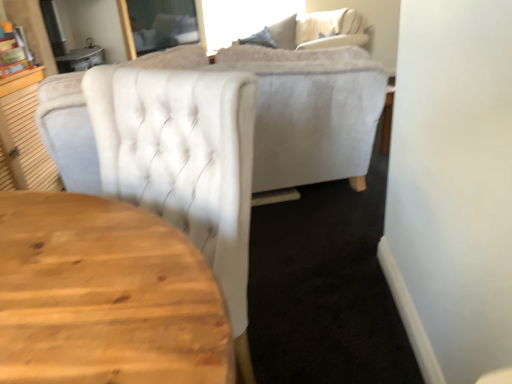
Question: From a real-world perspective, relative to velvet beige couch at upper center, is white tufted chair at upper center vertically above or below?

Choices:
 (A) above
 (B) below

Answer: (A)

Question: Considering the positions of point (88, 82) and point (312, 46), is point (88, 82) closer or farther from the camera than point (312, 46)?

Choices:
 (A) farther
 (B) closer

Answer: (B)

Question: Considering the positions of white tufted chair at upper center and velvet beige couch at upper center in the image, is white tufted chair at upper center bigger or smaller than velvet beige couch at upper center?

Choices:
 (A) big
 (B) small

Answer: (B)

Question: Considering the positions of velvet beige couch at upper center and white tufted chair at upper center in the image, is velvet beige couch at upper center taller or shorter than white tufted chair at upper center?

Choices:
 (A) short
 (B) tall

Answer: (A)

Question: Relative to white tufted chair at upper center, is velvet beige couch at upper center in front or behind?

Choices:
 (A) front
 (B) behind

Answer: (B)

Question: Do you think velvet beige couch at upper center is within white tufted chair at upper center, or outside of it?

Choices:
 (A) inside
 (B) outside

Answer: (B)

Question: Considering the positions of velvet beige couch at upper center and white tufted chair at upper center in the image, is velvet beige couch at upper center bigger or smaller than white tufted chair at upper center?

Choices:
 (A) big
 (B) small

Answer: (A)